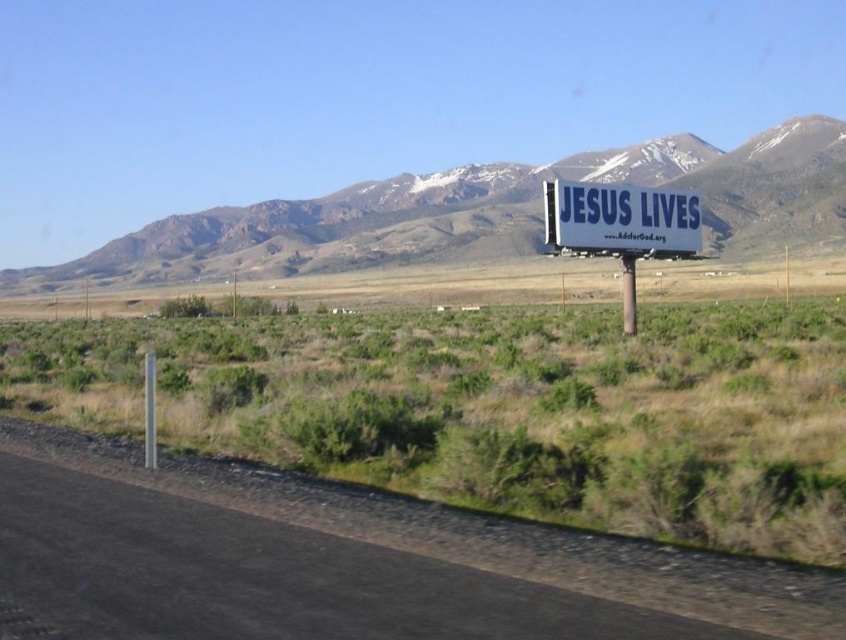
Question: Is rocky brown mountain range at upper center positioned behind white plastic billboard at center-right?

Choices:
 (A) no
 (B) yes

Answer: (B)

Question: Which of the following is the farthest from the observer?

Choices:
 (A) (150, 436)
 (B) (674, 216)

Answer: (B)

Question: Considering the real-world distances, which object is closest to the white plastic pole at center-right?

Choices:
 (A) rocky brown mountain range at upper center
 (B) black asphalt road at lower left

Answer: (B)

Question: Can you confirm if white plastic sign at right is positioned to the right of metallic pole at center-left?

Choices:
 (A) no
 (B) yes

Answer: (B)

Question: Which point is farther to the camera?

Choices:
 (A) black asphalt road at lower left
 (B) white plastic pole at center-right
 (C) white plastic billboard at center-right

Answer: (B)

Question: Does white plastic sign at right appear on the left side of metallic pole at center-left?

Choices:
 (A) yes
 (B) no

Answer: (B)